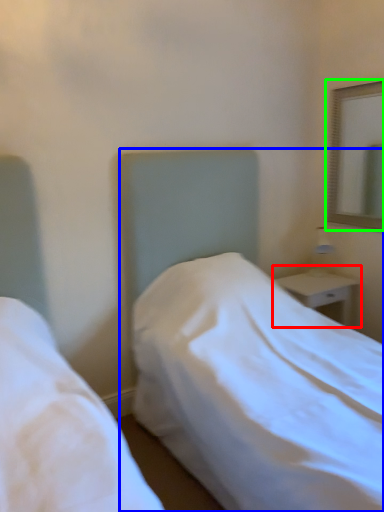
Question: Considering the real-world distances, which object is farthest from nightstand (highlighted by a red box)? bed (highlighted by a blue box) or mirror (highlighted by a green box)?

Choices:
 (A) bed
 (B) mirror

Answer: (B)